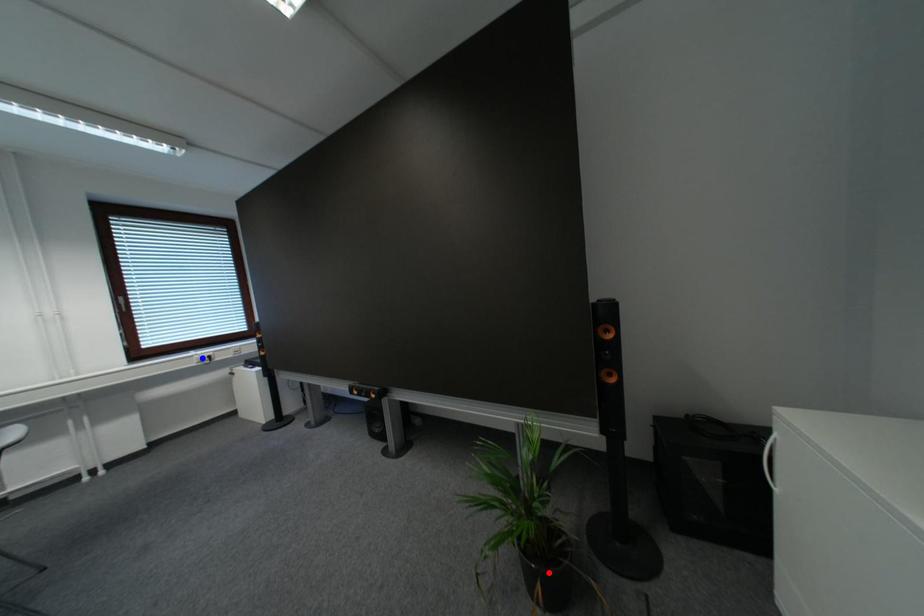
Question: Two points are marked on the image. Which point is closer to the camera?

Choices:
 (A) Blue point is closer.
 (B) Red point is closer.

Answer: (B)